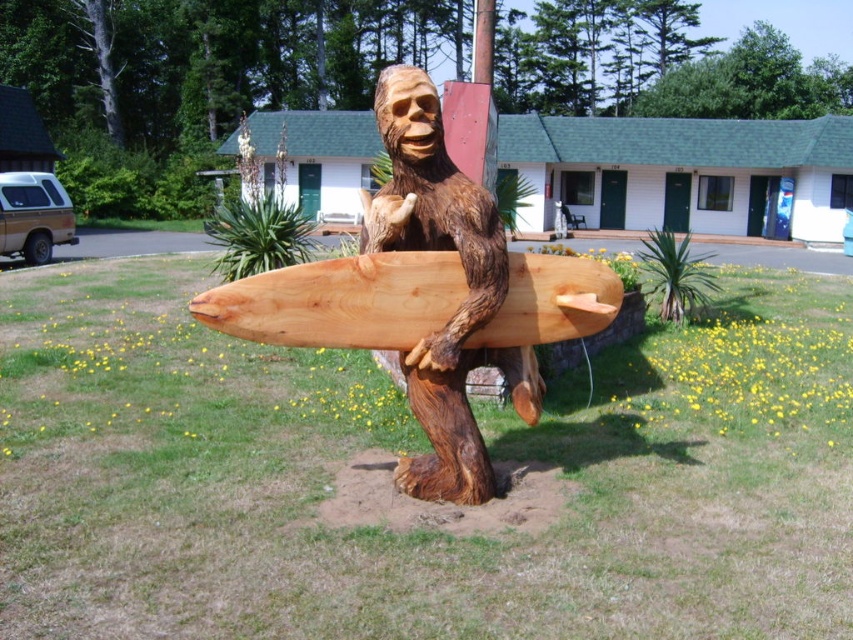
Who is taller, brown wood carving at center or natural wood surfboard at center?

brown wood carving at center

Is brown wood carving at center wider than natural wood surfboard at center?

No, brown wood carving at center is not wider than natural wood surfboard at center.

Where is `brown wood carving at center`? The width and height of the screenshot is (853, 640). brown wood carving at center is located at coordinates (460, 305).

The width and height of the screenshot is (853, 640). What are the coordinates of `brown wood carving at center` in the screenshot? It's located at (460, 305).

From the picture: Is wooden surfboard at center in front of natural wood surfboard at center?

No, wooden surfboard at center is further to the viewer.

Does wooden surfboard at center have a lesser width compared to natural wood surfboard at center?

Yes.

Which is behind, point (456, 422) or point (262, 296)?

Positioned behind is point (456, 422).

At what (x,y) coordinates should I click in order to perform the action: click on wooden surfboard at center. Please return your answer as a coordinate pair (x, y). The width and height of the screenshot is (853, 640). Looking at the image, I should click on (459, 305).

Does wooden surfboard at center have a lesser height compared to brown wood carving at center?

No.

Which is behind, point (459, 452) or point (476, 493)?

Point (476, 493)

Between point (422, 124) and point (529, 372), which one is positioned in front?

Point (422, 124)

I want to click on wooden surfboard at center, so click(459, 305).